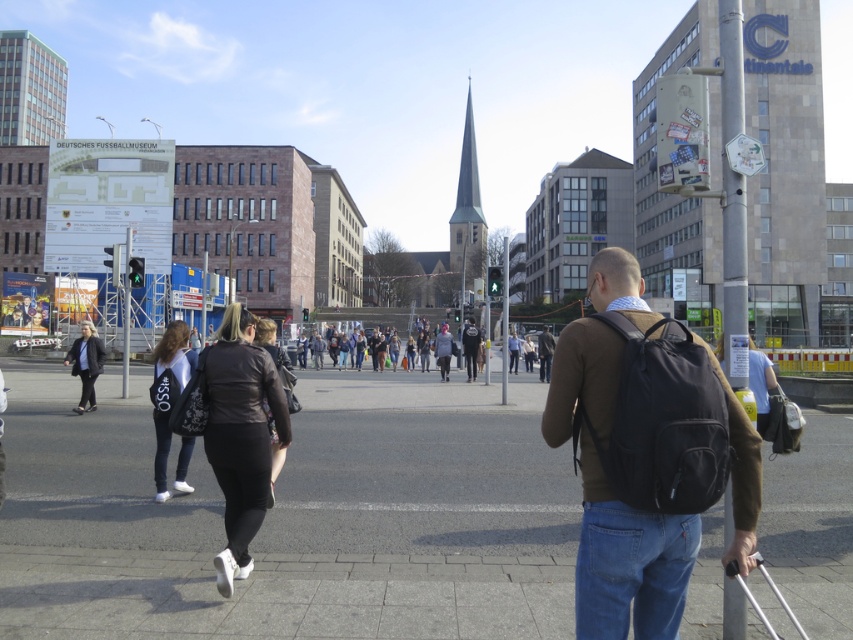
From the picture: You are standing at the pedestrian crossing in the bustling urban scene. You notice two points marked in the image. Which point, point (86, 381) or point (461, 342), is closer to you?

Point (86, 381) is closer to the viewer than point (461, 342).

What is located at the point with coordinates (292, 516) in the image?

The point at coordinates (292, 516) indicates smooth concrete pavement at center.

You are a delivery person who needs to place a 1.2 meter long package on the smooth concrete pavement at center. Can the package fit on the pavement if the white leather jacket at lower left is currently occupying part of it?

The smooth concrete pavement at center is shorter than the white leather jacket at lower left. Since the jacket is only 1.2 meters long, the pavement is shorter than that, so the package cannot fit on the smooth concrete pavement at center.